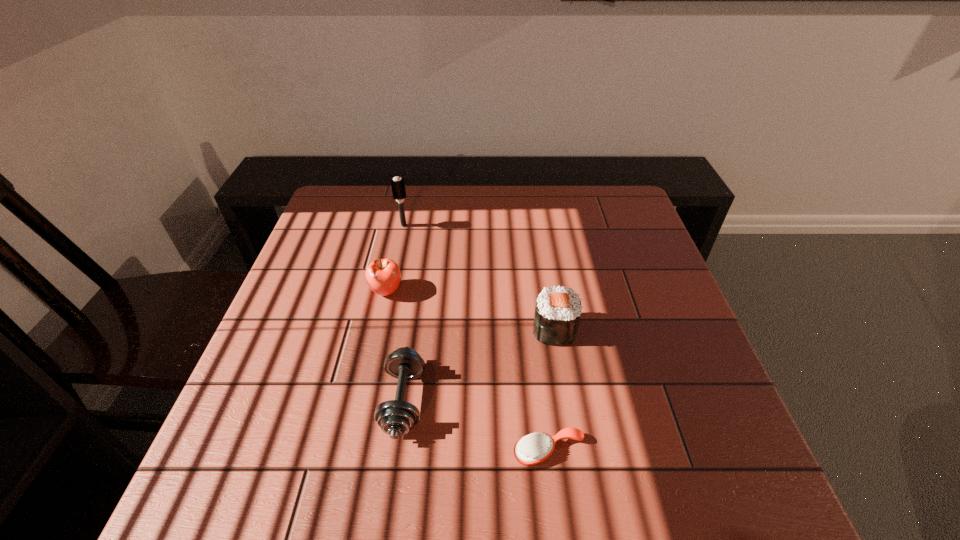
This screenshot has width=960, height=540. I want to click on the farthest object, so click(398, 188).

Locate an element on the screen. Image resolution: width=960 pixels, height=540 pixels. the taller hairbrush is located at coordinates (398, 188).

This screenshot has height=540, width=960. I want to click on apple, so click(x=383, y=276).

You are a GUI agent. You are given a task and a screenshot of the screen. Output one action in this format:
    pyautogui.click(x=<x>, y=<y>)
    Task: Click on the third farthest object
    
    Given the screenshot: What is the action you would take?
    pyautogui.click(x=557, y=314)

Locate an element on the screen. dumbbell is located at coordinates (396, 417).

The image size is (960, 540). What are the coordinates of `the shorter hairbrush` in the screenshot? It's located at (534, 448).

At what (x,y) coordinates should I click in order to perform the action: click on the nearer hairbrush. Please return your answer as a coordinate pair (x, y). The width and height of the screenshot is (960, 540). Looking at the image, I should click on (534, 448).

Identify the location of vacant point located 0.380m on the right of the farther hairbrush. Image resolution: width=960 pixels, height=540 pixels. (537, 226).

I want to click on blank space located on the front of the apple, so click(x=380, y=321).

Where is `vacant space positioned 0.180m on the back of the sushi`? This screenshot has width=960, height=540. vacant space positioned 0.180m on the back of the sushi is located at coordinates (544, 264).